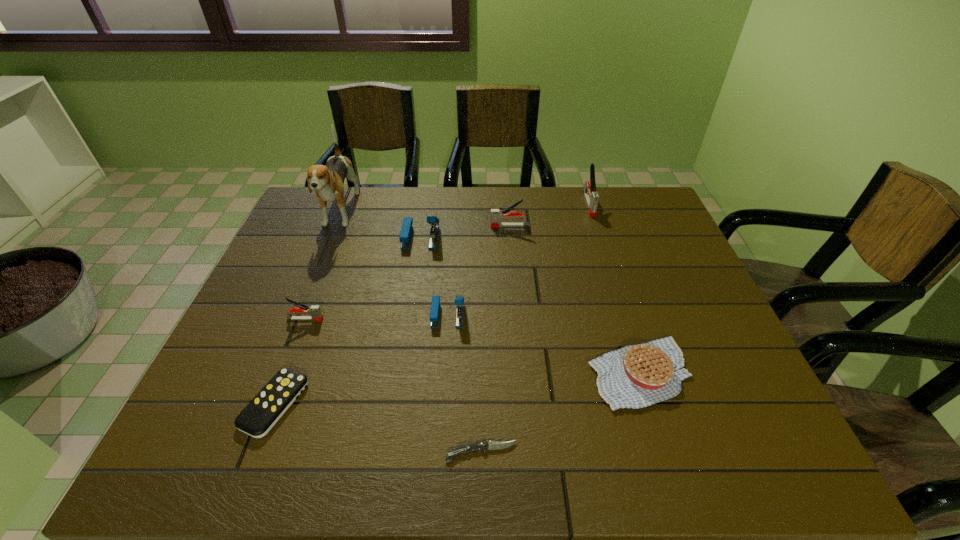
The image size is (960, 540). I want to click on the tallest object, so click(x=328, y=180).

Where is `puppy`? The image size is (960, 540). puppy is located at coordinates (328, 180).

Identify the location of the second tallest object. (591, 196).

You are a GUI agent. You are given a task and a screenshot of the screen. Output one action in this format:
    pyautogui.click(x=<x>, y=<y>)
    Task: Click on the biggest gray stapler
    
    Given the screenshot: What is the action you would take?
    coord(591,196)

I want to click on the second stapler from right to left, so click(x=497, y=215).

Locate an element on the screen. This screenshot has width=960, height=540. the second biggest gray stapler is located at coordinates (497, 215).

The width and height of the screenshot is (960, 540). Find the location of `the fourth object from left to right`. the fourth object from left to right is located at coordinates (405, 236).

What are the coordinates of `the farther blue stapler` in the screenshot? It's located at (405, 236).

What are the coordinates of `the leftmost stapler` in the screenshot? It's located at (316, 315).

Identify the location of the smallest gray stapler. The height and width of the screenshot is (540, 960). pos(316,315).